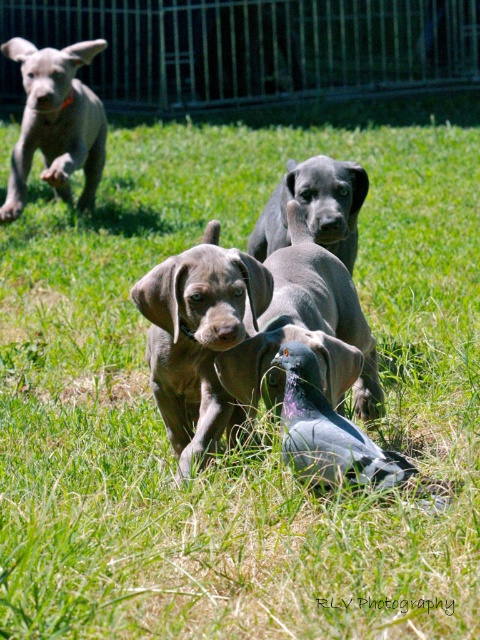
Question: Does shiny gray puppy at center appear on the right side of gray matte pigeon at center?

Choices:
 (A) yes
 (B) no

Answer: (B)

Question: Which object appears closest to the camera in this image?

Choices:
 (A) shiny gray puppy at center
 (B) smooth gray dog at center

Answer: (A)

Question: Can you confirm if shiny gray puppy at center is positioned to the left of smooth gray dog at center?

Choices:
 (A) no
 (B) yes

Answer: (B)

Question: Does smooth gray puppy at upper left lie in front of gray matte pigeon at center?

Choices:
 (A) no
 (B) yes

Answer: (A)

Question: Which point is farther to the camera?

Choices:
 (A) (298, 188)
 (B) (158, 349)
 (C) (335, 390)
 (D) (280, 358)

Answer: (A)

Question: Which object is positioned farthest from the shiny black puppy at center?

Choices:
 (A) smooth gray dog at center
 (B) smooth gray puppy at upper left

Answer: (B)